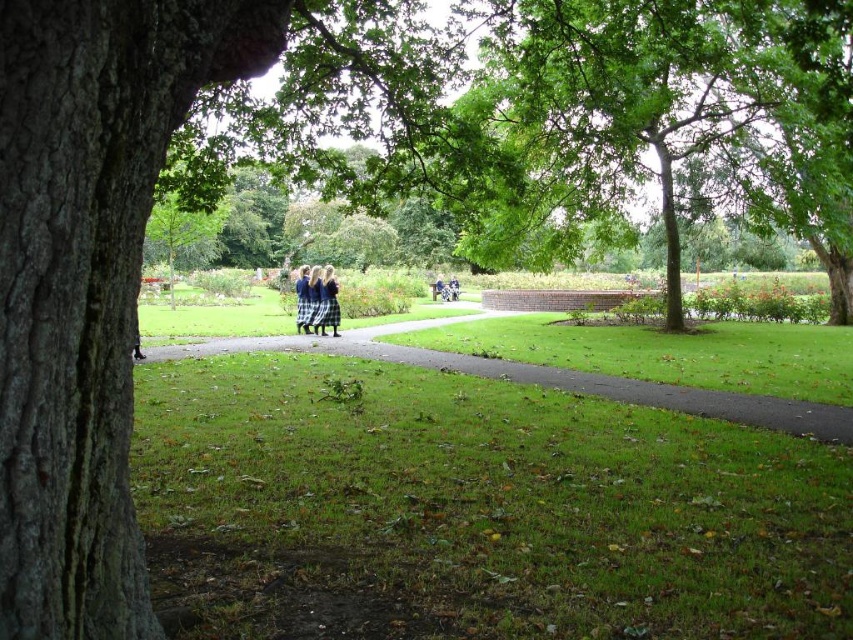
In the scene shown: Does silk blue dress at center have a lesser height compared to blue plaid skirt at center?

In fact, silk blue dress at center may be taller than blue plaid skirt at center.

Which is behind, point (328, 269) or point (306, 282)?

The point (306, 282) is behind.

Locate an element on the screen. silk blue dress at center is located at coordinates (321, 300).

In the scene shown: Who is higher up, silk blue dress at center or dark blue skirt at center?

dark blue skirt at center is higher up.

Is point (323, 289) positioned behind point (335, 301)?

That is True.

What do you see at coordinates (321, 300) in the screenshot? I see `silk blue dress at center` at bounding box center [321, 300].

In order to click on silk blue dress at center in this screenshot , I will do `click(321, 300)`.

In the scene shown: Is dark blue skirt at center further to camera compared to blue plaid skirt at center?

That is False.

Is point (328, 266) less distant than point (305, 269)?

Yes, it is in front of point (305, 269).

The height and width of the screenshot is (640, 853). I want to click on dark blue skirt at center, so click(x=329, y=301).